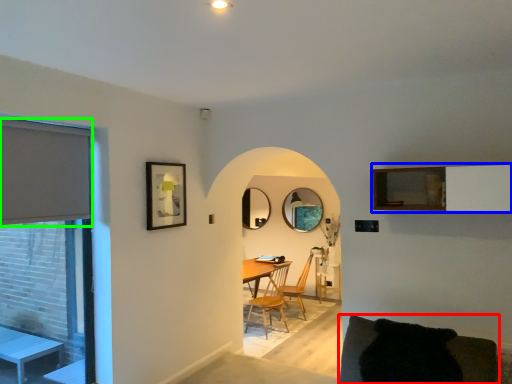
Question: Which is farther away from couch (highlighted by a red box)? balcony (highlighted by a blue box) or window screen (highlighted by a green box)?

Choices:
 (A) balcony
 (B) window screen

Answer: (B)